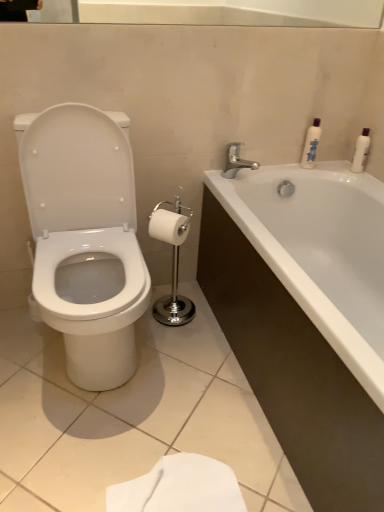
What do you see at coordinates (321, 251) in the screenshot?
I see `white glossy bathtub at right` at bounding box center [321, 251].

Measure the distance between white glossy bathtub at right and camera.

A distance of 85.04 centimeters exists between white glossy bathtub at right and camera.

Describe the element at coordinates (85, 239) in the screenshot. The image size is (384, 512). I see `white glossy toilet at left` at that location.

Measure the distance between point (357, 157) and camera.

The depth of point (357, 157) is 6.25 feet.

The image size is (384, 512). Identify the location of silver metallic faucet at upper right. (236, 161).

The height and width of the screenshot is (512, 384). I want to click on white glossy bathtub at right, so click(321, 251).

Between point (253, 166) and point (368, 128), which one is positioned behind?

Positioned behind is point (368, 128).

From the silver metallic faucet at upper right, count 2nd toiletry to the right and point to it. Please provide its 2D coordinates.

[(361, 152)]

Is silver metallic faucet at upper right outside of white plastic bottle at upper right, which ranks as the 1th toiletry in right-to-left order?

Yes, silver metallic faucet at upper right is not within white plastic bottle at upper right, which ranks as the 1th toiletry in right-to-left order.

Which object is closer to the camera, silver metallic faucet at upper right or white plastic bottle at upper right, which appears as the second toiletry when viewed from the left?

silver metallic faucet at upper right is more forward.

Can you tell me how much white glossy bathtub at right and white plastic bottle at upper right, which ranks as the 1th toiletry in right-to-left order, differ in facing direction?

The angle between the facing direction of white glossy bathtub at right and the facing direction of white plastic bottle at upper right, which ranks as the 1th toiletry in right-to-left order, is 4.19 degrees.

Considering their positions, is white glossy bathtub at right located in front of or behind white plastic bottle at upper right, which ranks as the 1th toiletry in right-to-left order?

white glossy bathtub at right is positioned closer to the viewer than white plastic bottle at upper right, which ranks as the 1th toiletry in right-to-left order.

From a real-world perspective, who is located lower, white glossy bathtub at right or white plastic bottle at upper right, which ranks as the 1th toiletry in right-to-left order?

white glossy bathtub at right.

Can you confirm if white glossy bathtub at right is wider than white plastic bottle at upper right, which ranks as the 1th toiletry in right-to-left order?

Yes.

Is white plastic bottle at upper right, which ranks as the 1th toiletry in right-to-left order, next to white glossy bathtub at right and touching it?

white plastic bottle at upper right, which ranks as the 1th toiletry in right-to-left order, and white glossy bathtub at right are clearly separated.

From the image's perspective, count 1st toiletrys upward from the white glossy bathtub at right and point to it. Please provide its 2D coordinates.

[(361, 152)]

Considering the points (359, 172) and (377, 345), which point is in front, point (359, 172) or point (377, 345)?

The point (377, 345) is more forward.

Looking at this image, from a real-world perspective, between white plastic bottle at upper right, which ranks as the 1th toiletry in right-to-left order, and white glossy bathtub at right, who is vertically lower?

In real-world perspective, white glossy bathtub at right is lower.

Is white glossy toilet at left oriented away from white matte toilet paper at center?

No.

Is point (36, 167) more distant than point (161, 218)?

No, it is not.

Who is shorter, white glossy toilet at left or white matte toilet paper at center?

white matte toilet paper at center.

Looking at their sizes, would you say white glossy toilet at left is wider or thinner than white matte toilet paper at center?

In the image, white glossy toilet at left appears to be wider than white matte toilet paper at center.

The width and height of the screenshot is (384, 512). Identify the location of bathtub in front of the white matte toilet paper at center. (321, 251).

From a real-world perspective, is white matte toilet paper at center physically located above or below white glossy bathtub at right?

From a real-world perspective, white matte toilet paper at center is physically above white glossy bathtub at right.

Is white matte toilet paper at center facing towards white glossy bathtub at right?

No, white matte toilet paper at center is not oriented towards white glossy bathtub at right.

Is white matte toilet paper at center shorter than white glossy bathtub at right?

Yes.

Is white plastic bottle at upper right, which ranks as the 1th toiletry in right-to-left order, facing away from white matte toilet paper at center?

No.

Between point (362, 162) and point (163, 225), which one is positioned in front?

The point (163, 225) is more forward.

Is white matte toilet paper at center aimed at white glossy lotion at upper right, which is the second toiletry in right-to-left order?

No, white matte toilet paper at center does not turn towards white glossy lotion at upper right, which is the second toiletry in right-to-left order.

Considering the positions of objects white matte toilet paper at center and white glossy lotion at upper right, the first toiletry positioned from the left, in the image provided, who is in front, white matte toilet paper at center or white glossy lotion at upper right, the first toiletry positioned from the left,?

white matte toilet paper at center is closer to the camera.

Which of these two, white matte toilet paper at center or white glossy lotion at upper right, which is the second toiletry in right-to-left order, is smaller?

Smaller between the two is white glossy lotion at upper right, which is the second toiletry in right-to-left order.

At what (x,y) coordinates should I click in order to perform the action: click on the 1st toiletry above the silver metallic faucet at upper right (from a real-world perspective). Please return your answer as a coordinate pair (x, y). Image resolution: width=384 pixels, height=512 pixels. Looking at the image, I should click on point(361,152).

From the white glossy bathtub at right, count 2nd toiletrys backward and point to it. Please provide its 2D coordinates.

[(361, 152)]

Considering their positions, is silver metallic faucet at upper right positioned closer to white glossy bathtub at right than white plastic bottle at upper right, which appears as the second toiletry when viewed from the left?

silver metallic faucet at upper right.

Looking at the image, which one is located further to white matte toilet paper at center, white glossy toilet at left or white glossy lotion at upper right, which is the second toiletry in right-to-left order?

Among the two, white glossy lotion at upper right, which is the second toiletry in right-to-left order, is located further to white matte toilet paper at center.

Estimate the real-world distances between objects in this image. Which object is closer to white glossy bathtub at right, white plastic bottle at upper right, which ranks as the 1th toiletry in right-to-left order, or white glossy lotion at upper right, the first toiletry positioned from the left?

white glossy lotion at upper right, the first toiletry positioned from the left, is positioned closer to the anchor white glossy bathtub at right.

Which object lies further to the anchor point white glossy toilet at left, white glossy lotion at upper right, the first toiletry positioned from the left, or white glossy bathtub at right?

white glossy lotion at upper right, the first toiletry positioned from the left.

Looking at the image, which one is located closer to white glossy lotion at upper right, which is the second toiletry in right-to-left order, silver metallic faucet at upper right or white glossy toilet at left?

The object closer to white glossy lotion at upper right, which is the second toiletry in right-to-left order, is silver metallic faucet at upper right.

Estimate the real-world distances between objects in this image. Which object is closer to white glossy lotion at upper right, which is the second toiletry in right-to-left order, white glossy bathtub at right or white plastic bottle at upper right, which ranks as the 1th toiletry in right-to-left order?

Among the two, white plastic bottle at upper right, which ranks as the 1th toiletry in right-to-left order, is located nearer to white glossy lotion at upper right, which is the second toiletry in right-to-left order.

Based on the photo, estimate the real-world distances between objects in this image. Which object is further from white matte toilet paper at center, silver metallic faucet at upper right or white glossy toilet at left?

silver metallic faucet at upper right is positioned further to the anchor white matte toilet paper at center.

Based on their spatial positions, is white matte toilet paper at center or white glossy lotion at upper right, which is the second toiletry in right-to-left order, further from white glossy bathtub at right?

Among the two, white matte toilet paper at center is located further to white glossy bathtub at right.

You are a GUI agent. You are given a task and a screenshot of the screen. Output one action in this format:
    pyautogui.click(x=<x>, y=<y>)
    Task: Click on the tap situated between white glossy toilet at left and white plastic bottle at upper right, which ranks as the 1th toiletry in right-to-left order, from left to right
    
    Given the screenshot: What is the action you would take?
    pyautogui.click(x=236, y=161)

Locate an element on the screen. toilet paper positioned between white glossy bathtub at right and white glossy lotion at upper right, which is the second toiletry in right-to-left order, from near to far is located at coordinates (169, 226).

The height and width of the screenshot is (512, 384). I want to click on toilet paper between white glossy toilet at left and white glossy bathtub at right from left to right, so click(169, 226).

Identify the location of toilet paper between white glossy toilet at left and white plastic bottle at upper right, which ranks as the 1th toiletry in right-to-left order. The height and width of the screenshot is (512, 384). (x=169, y=226).